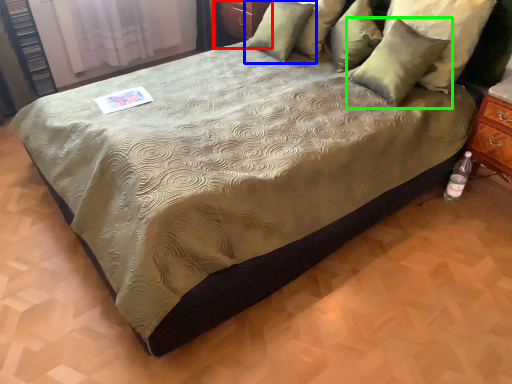
Question: Estimate the real-world distances between objects in this image. Which object is closer to dresser (highlighted by a red box), pillow (highlighted by a blue box) or pillow (highlighted by a green box)?

Choices:
 (A) pillow
 (B) pillow

Answer: (A)